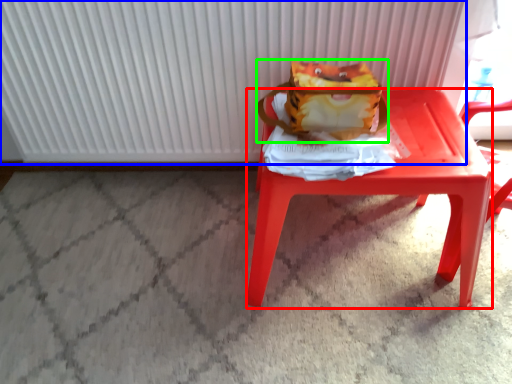
Question: Considering the real-world distances, which object is closest to stool (highlighted by a red box)? radiator (highlighted by a blue box) or shoulder bag (highlighted by a green box).

Choices:
 (A) radiator
 (B) shoulder bag

Answer: (B)